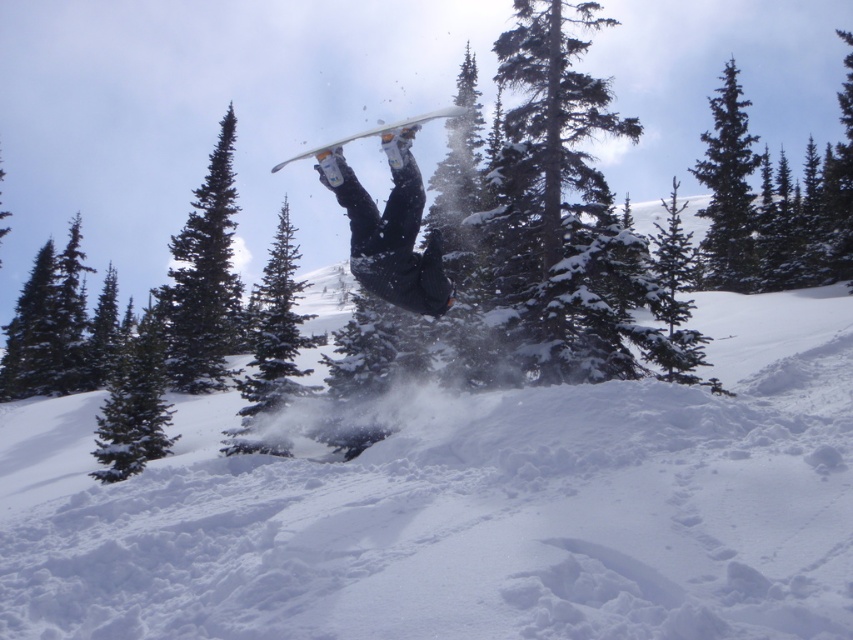
Does green matte tree at upper left appear under green matte tree at upper right?

Yes, green matte tree at upper left is below green matte tree at upper right.

Who is taller, green matte tree at upper left or green matte tree at upper right?

Standing taller between the two is green matte tree at upper right.

The image size is (853, 640). I want to click on green matte tree at upper left, so click(204, 278).

Who is shorter, white fluffy snow at center or matte black snowboard at center?

white fluffy snow at center is shorter.

Where is `white fluffy snow at center`? The image size is (853, 640). white fluffy snow at center is located at coordinates (469, 509).

Does white fluffy snow at center appear under snow-covered evergreen tree at center?

Indeed, white fluffy snow at center is positioned under snow-covered evergreen tree at center.

Which is below, white fluffy snow at center or snow-covered evergreen tree at center?

white fluffy snow at center is lower down.

Measure the distance between white fluffy snow at center and camera.

They are 15.72 feet apart.

Where is `white fluffy snow at center`? This screenshot has width=853, height=640. white fluffy snow at center is located at coordinates 469,509.